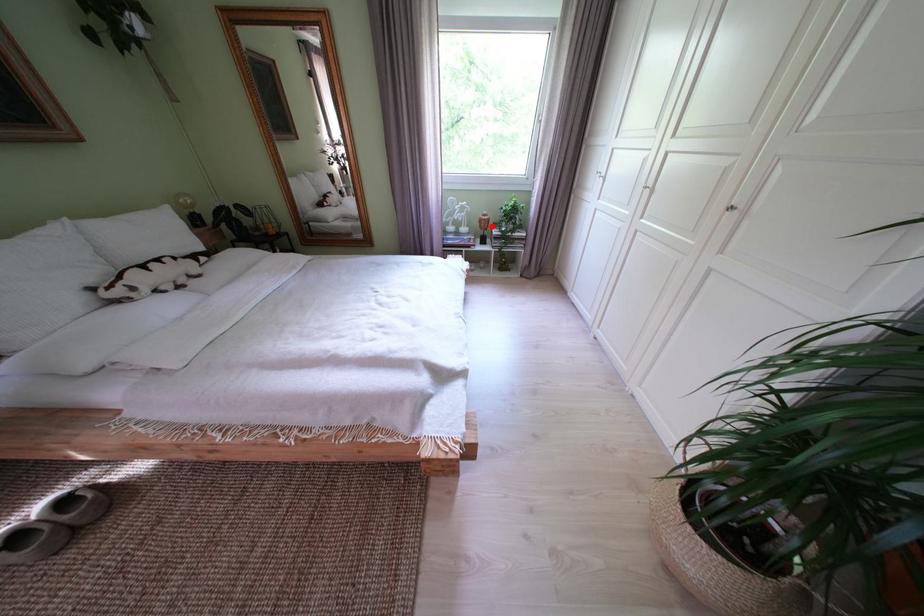
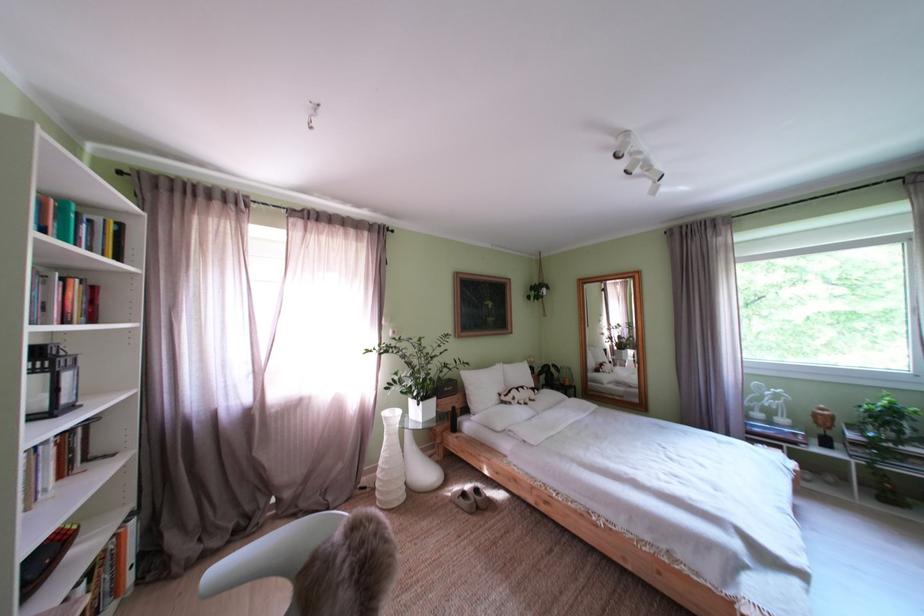
In the second image, find the point that corresponds to the highlighted location in the first image.

(825, 419)